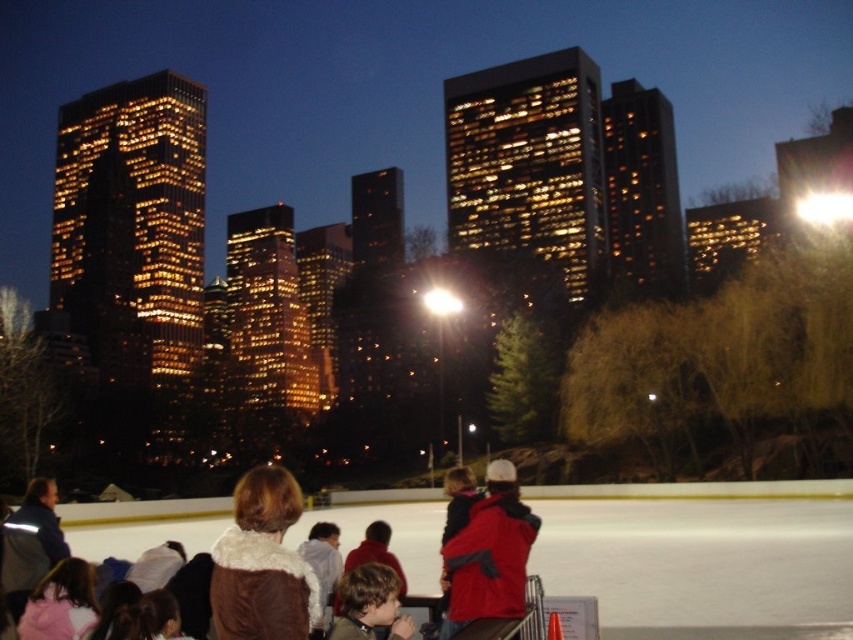
Question: Does red matte jacket at center appear on the right side of brown fuzzy jacket at lower center?

Choices:
 (A) yes
 (B) no

Answer: (A)

Question: Which point appears closest to the camera in this image?

Choices:
 (A) (339, 637)
 (B) (502, 461)
 (C) (234, 604)

Answer: (A)

Question: Where is brown fur coat at center located in relation to red matte jacket at center in the image?

Choices:
 (A) above
 (B) below

Answer: (B)

Question: Which point appears farthest from the camera in this image?

Choices:
 (A) (381, 589)
 (B) (511, 508)
 (C) (212, 592)

Answer: (B)

Question: Does red matte jacket at center appear on the right side of brown fuzzy jacket at lower center?

Choices:
 (A) yes
 (B) no

Answer: (A)

Question: Which object is the farthest from the red matte jacket at center?

Choices:
 (A) brown fur coat at center
 (B) brown fuzzy jacket at lower center

Answer: (A)